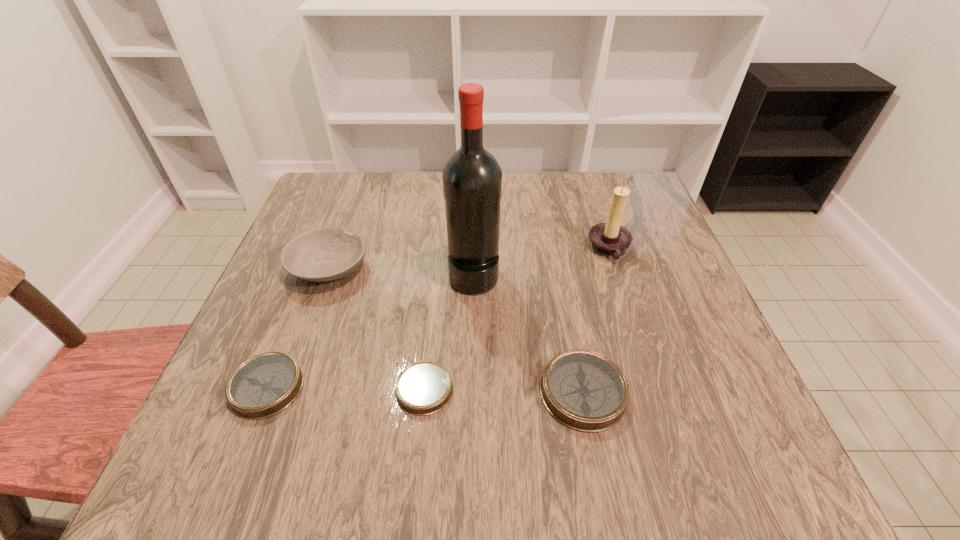
The height and width of the screenshot is (540, 960). What are the coordinates of `the closest compass relative to the candle holder` in the screenshot? It's located at (584, 390).

This screenshot has height=540, width=960. I want to click on compass that is the closest to the shortest compass, so click(x=584, y=390).

This screenshot has height=540, width=960. I want to click on vacant point that satisfies the following two spatial constraints: 1. on the front side of the fifth tallest object; 2. on the left side of the rightmost compass, so point(265,392).

Where is `vacant region that satisfies the following two spatial constraints: 1. on the front side of the rightmost compass; 2. on the left side of the fourth shortest object`? Image resolution: width=960 pixels, height=540 pixels. vacant region that satisfies the following two spatial constraints: 1. on the front side of the rightmost compass; 2. on the left side of the fourth shortest object is located at coordinates (284, 392).

Where is `vacant space that satisfies the following two spatial constraints: 1. on the front side of the tallest object; 2. on the right side of the fourth shortest object`? This screenshot has height=540, width=960. vacant space that satisfies the following two spatial constraints: 1. on the front side of the tallest object; 2. on the right side of the fourth shortest object is located at coordinates (326, 275).